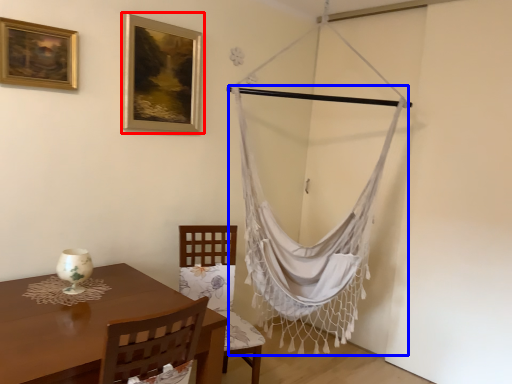
Question: Which of the following is the farthest to the observer, picture frame (highlighted by a red box) or curtain (highlighted by a blue box)?

Choices:
 (A) picture frame
 (B) curtain

Answer: (B)